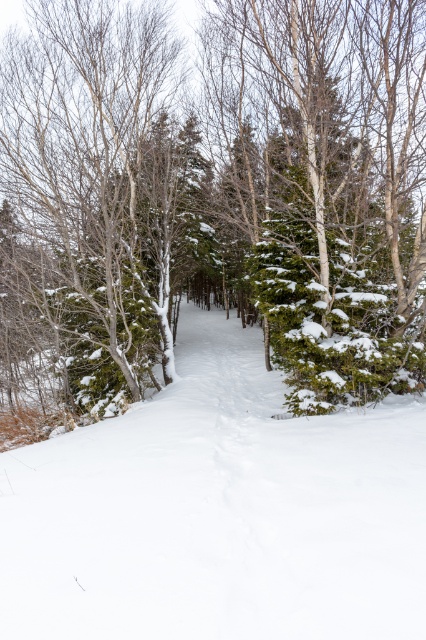
Does snow-covered evergreen tree at center have a lesser height compared to white snow ski slope at center?

No.

Is point (371, 112) positioned before point (417, 474)?

That is False.

You are a GUI agent. You are given a task and a screenshot of the screen. Output one action in this format:
    pyautogui.click(x=<x>, y=<y>)
    Task: Click on the snow-covered evergreen tree at center
    The height and width of the screenshot is (640, 426).
    Given the screenshot: What is the action you would take?
    pyautogui.click(x=213, y=195)

Is snow-covered evergreen tree at center shorter than snow-covered evergreen tree at left?

No, snow-covered evergreen tree at center is not shorter than snow-covered evergreen tree at left.

You are a GUI agent. You are given a task and a screenshot of the screen. Output one action in this format:
    pyautogui.click(x=<x>, y=<y>)
    Task: Click on the snow-covered evergreen tree at center
    This screenshot has height=640, width=426.
    Given the screenshot: What is the action you would take?
    pyautogui.click(x=213, y=195)

Can you confirm if white snow ski slope at center is positioned to the right of snow-covered evergreen tree at left?

Indeed, white snow ski slope at center is positioned on the right side of snow-covered evergreen tree at left.

Is white snow ski slope at center closer to camera compared to snow-covered evergreen tree at left?

Yes, it is in front of snow-covered evergreen tree at left.

At what (x,y) coordinates should I click in order to perform the action: click on white snow ski slope at center. Please return your answer as a coordinate pair (x, y). Image resolution: width=426 pixels, height=640 pixels. Looking at the image, I should click on (218, 513).

Locate an element on the screen. The height and width of the screenshot is (640, 426). white snow ski slope at center is located at coordinates (218, 513).